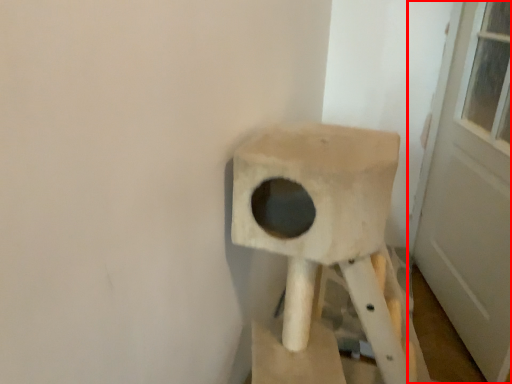
Question: Where is door (annotated by the red box) located in relation to swivel chair in the image?

Choices:
 (A) right
 (B) left

Answer: (A)